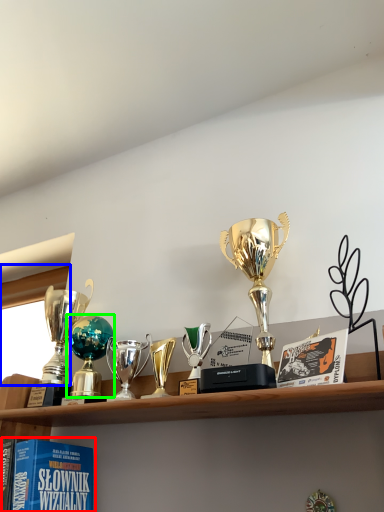
Question: Which object is positioned closest to book (highlighted by a red box)? Select from window screen (highlighted by a blue box) and trophy (highlighted by a green box).

Choices:
 (A) window screen
 (B) trophy

Answer: (B)